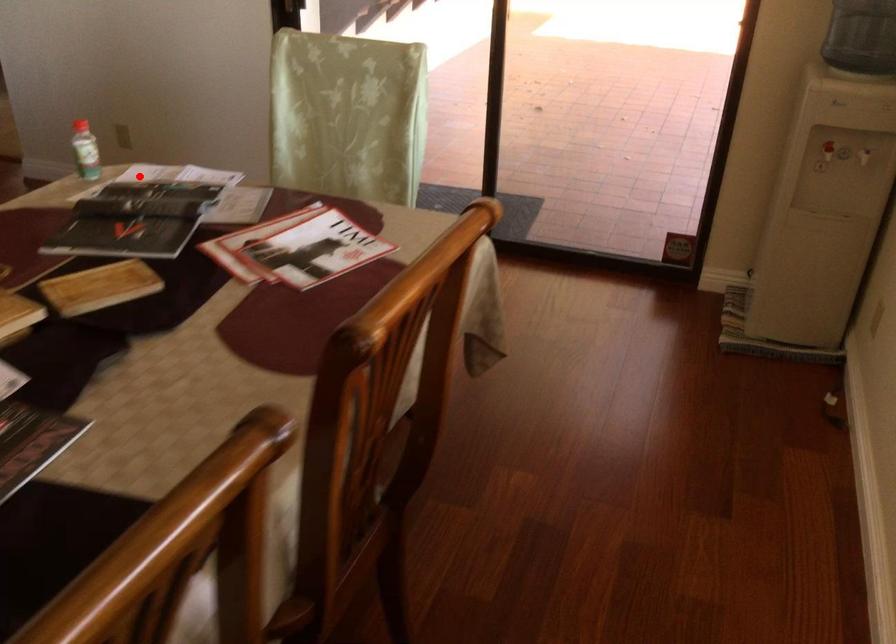
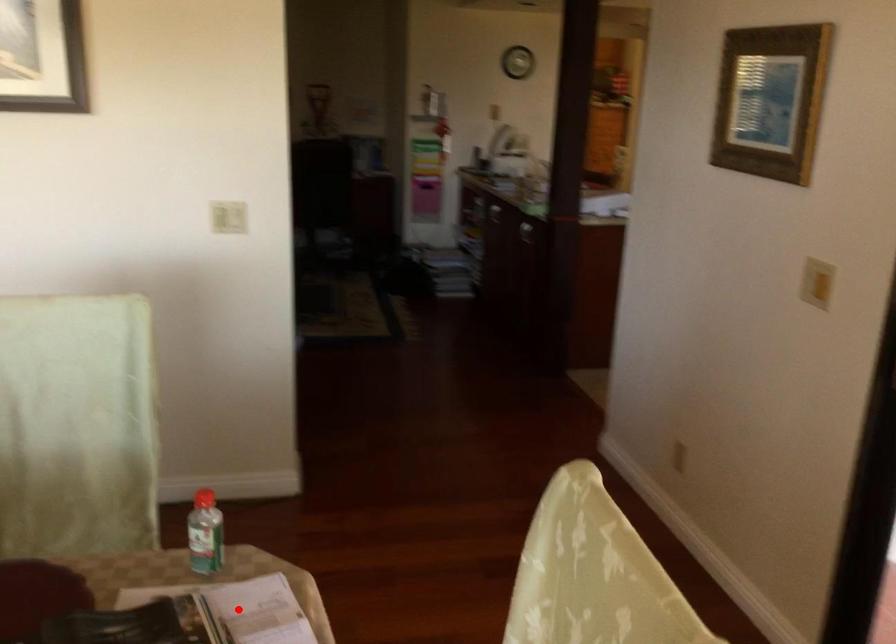
I am providing you with two images of the same scene from different viewpoints. A red point is marked on the first image and another point is marked on the second image. Does the point marked in image1 correspond to the same location as the one in image2?

Yes